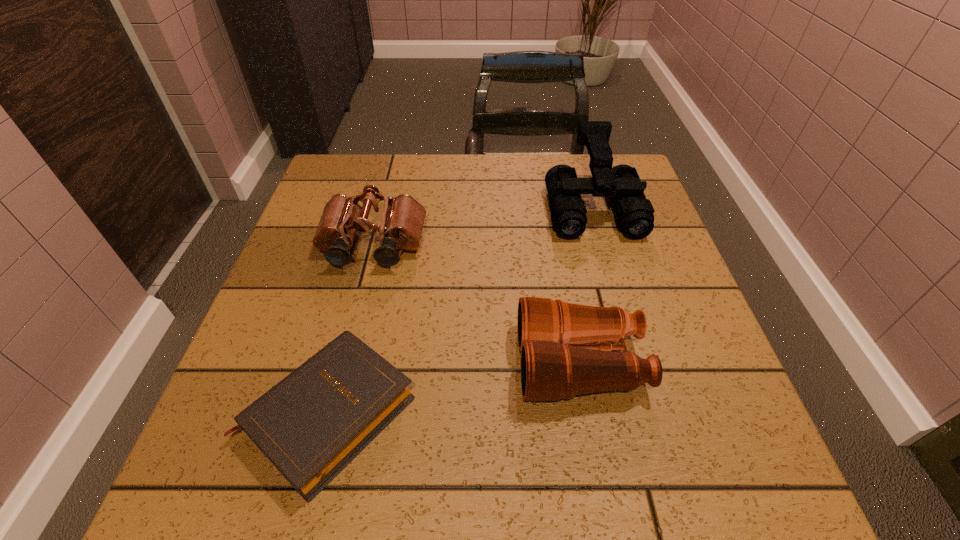
Locate an element on the screen. the tallest binoculars is located at coordinates (635, 214).

The width and height of the screenshot is (960, 540). In order to click on the leftmost binoculars in this screenshot , I will do `click(402, 221)`.

Find the location of a particular element. This screenshot has height=540, width=960. the nearest binoculars is located at coordinates (557, 361).

Where is `Bible`? The height and width of the screenshot is (540, 960). Bible is located at coordinates (314, 422).

Find the location of a particular element. The height and width of the screenshot is (540, 960). vacant space located on the front lenses of the tallest binoculars is located at coordinates (624, 315).

You are a GUI agent. You are given a task and a screenshot of the screen. Output one action in this format:
    pyautogui.click(x=<x>, y=<y>)
    Task: Click on the free space located through the eyepieces of the leftmost binoculars
    The height and width of the screenshot is (540, 960).
    Given the screenshot: What is the action you would take?
    pyautogui.click(x=345, y=359)

What are the coordinates of `vacant space located through the lenses of the nearest binoculars` in the screenshot? It's located at (436, 363).

Identify the location of vacant region located 0.350m through the lenses of the nearest binoculars. (325, 363).

Locate an element on the screen. This screenshot has height=540, width=960. free location located 0.170m through the lenses of the nearest binoculars is located at coordinates (425, 363).

This screenshot has width=960, height=540. I want to click on free space located on the back of the Bible, so click(363, 279).